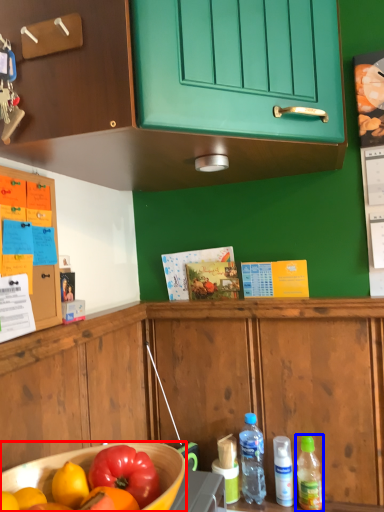
Question: Which point is further to the camera, bowl (highlighted by a red box) or bottle (highlighted by a blue box)?

Choices:
 (A) bowl
 (B) bottle

Answer: (B)